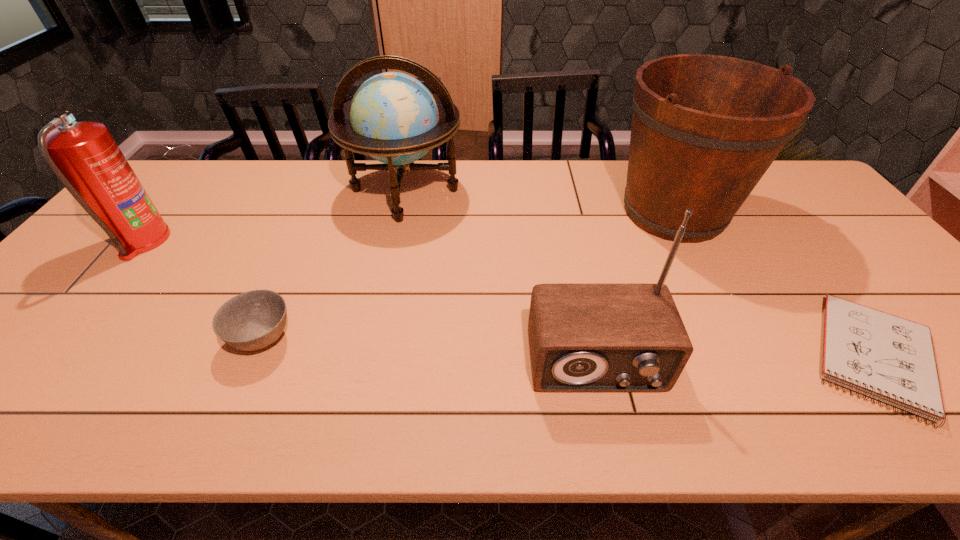
Locate an element on the screen. free space between the second shortest object and the radio receiver is located at coordinates (429, 351).

Find the location of a particular element. The height and width of the screenshot is (540, 960). blank region between the bucket and the globe is located at coordinates (540, 201).

Find the location of a particular element. The height and width of the screenshot is (540, 960). empty space between the globe and the fifth tallest object is located at coordinates (x=334, y=265).

Where is `object that stands as the closest to the bucket`? This screenshot has width=960, height=540. object that stands as the closest to the bucket is located at coordinates (889, 358).

At what (x,y) coordinates should I click in order to perform the action: click on object that stands as the second closest to the second shortest object. Please return your answer as a coordinate pair (x, y). Looking at the image, I should click on (85, 158).

Where is `vacant space that satisfies the following two spatial constraints: 1. on the instruction side of the fire extinguisher; 2. on the left side of the bowl`? vacant space that satisfies the following two spatial constraints: 1. on the instruction side of the fire extinguisher; 2. on the left side of the bowl is located at coordinates (60, 339).

This screenshot has width=960, height=540. I want to click on vacant space that satisfies the following two spatial constraints: 1. on the surface of the bucket; 2. on the left side of the globe, so click(x=400, y=212).

Locate an element on the screen. free location that satisfies the following two spatial constraints: 1. on the surface of the bucket; 2. on the left side of the globe is located at coordinates tap(400, 212).

Locate an element on the screen. The width and height of the screenshot is (960, 540). vacant region that satisfies the following two spatial constraints: 1. on the front side of the bucket; 2. on the instruction side of the fire extinguisher is located at coordinates (688, 241).

This screenshot has height=540, width=960. In order to click on free space that satisfies the following two spatial constraints: 1. on the instruction side of the fire extinguisher; 2. on the back side of the fifth tallest object in this screenshot , I will do 60,339.